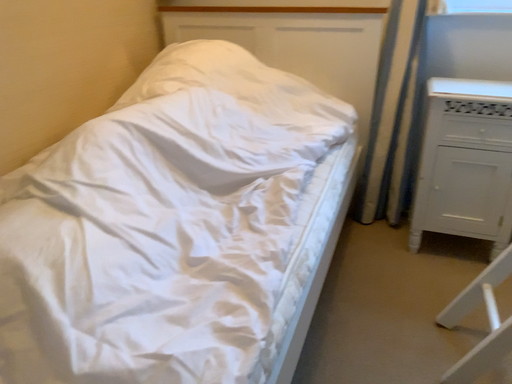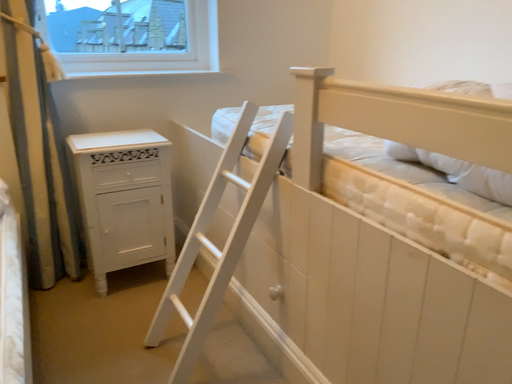
Question: Which way did the camera rotate in the video?

Choices:
 (A) rotated right
 (B) rotated left

Answer: (A)